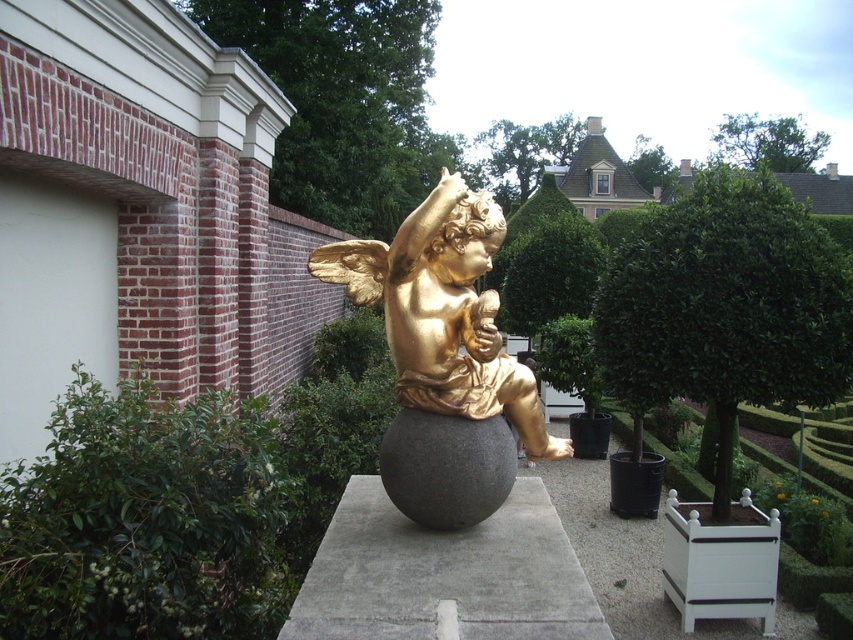
Can you confirm if green leafy hedge at left is thinner than gold polished statue at center?

Yes.

You are a GUI agent. You are given a task and a screenshot of the screen. Output one action in this format:
    pyautogui.click(x=<x>, y=<y>)
    Task: Click on the green leafy hedge at left
    This screenshot has height=640, width=853.
    Given the screenshot: What is the action you would take?
    pyautogui.click(x=144, y=518)

Is point (138, 378) farther from viewer compared to point (434, 228)?

Yes, it is behind point (434, 228).

What are the coordinates of `green leafy hedge at left` in the screenshot? It's located at pos(144,518).

Is gold polished statue at center above gray concrete at center?

Indeed, gold polished statue at center is positioned over gray concrete at center.

Which is more to the left, gold polished statue at center or gray concrete at center?

From the viewer's perspective, gold polished statue at center appears more on the left side.

Locate an element on the screen. gold polished statue at center is located at coordinates (444, 358).

Is green leafy hedge at left bigger than gray concrete at center?

Correct, green leafy hedge at left is larger in size than gray concrete at center.

How far apart are green leafy hedge at left and gray concrete at center?

25.20 inches

Which is in front, point (7, 516) or point (563, 531)?

Point (7, 516) is more forward.

Where is `green leafy hedge at left`? The height and width of the screenshot is (640, 853). green leafy hedge at left is located at coordinates (144, 518).